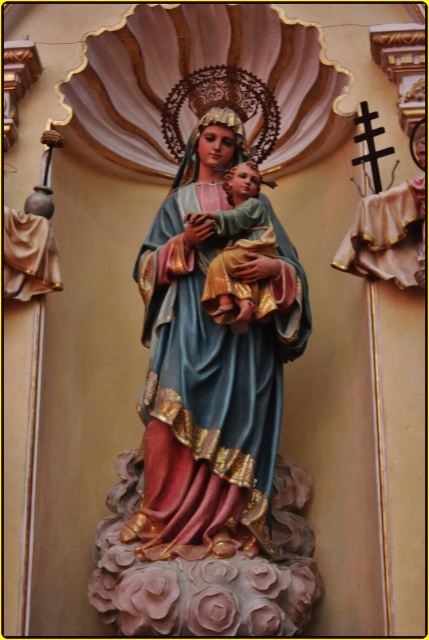
Question: Which point is farther from the camera taking this photo?

Choices:
 (A) (221, 333)
 (B) (210, 273)

Answer: (B)

Question: Which of the following is the closest to the observer?

Choices:
 (A) (229, 291)
 (B) (247, 372)

Answer: (A)

Question: Is polychrome wood statue of madonna and child at center positioned in front of gold textured fabric at center?

Choices:
 (A) yes
 (B) no

Answer: (A)

Question: Does polychrome wood statue of madonna and child at center come behind gold textured fabric at center?

Choices:
 (A) yes
 (B) no

Answer: (B)

Question: Which object appears closest to the camera in this image?

Choices:
 (A) gold textured fabric at center
 (B) polychrome wood statue of madonna and child at center

Answer: (B)

Question: Is polychrome wood statue of madonna and child at center in front of gold textured fabric at center?

Choices:
 (A) yes
 (B) no

Answer: (A)